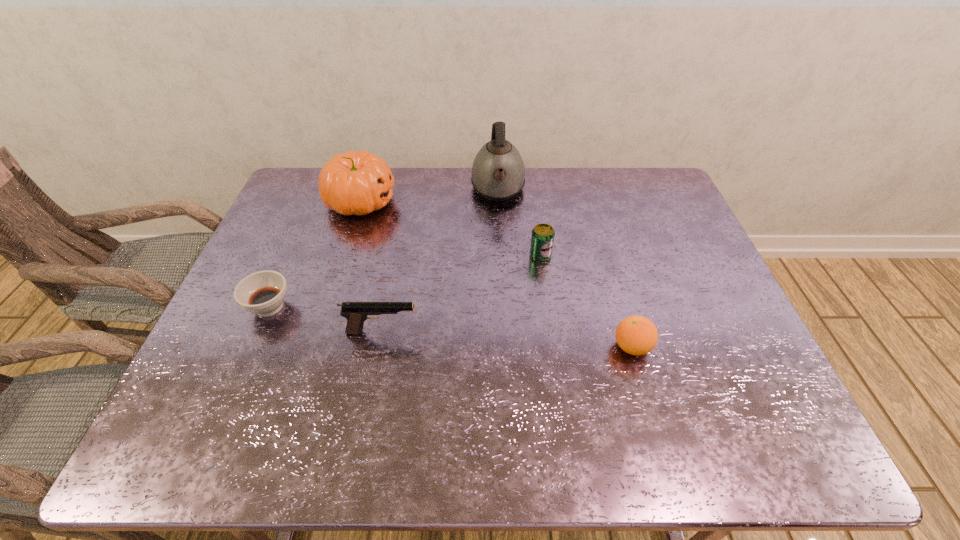
In the image, there is a desktop. Identify the location of vacant space at the left edge. The image size is (960, 540). (220, 395).

In the image, there is a desktop. Where is `vacant area at the right edge`? Image resolution: width=960 pixels, height=540 pixels. vacant area at the right edge is located at coordinates (703, 377).

This screenshot has width=960, height=540. In the image, there is a desktop. Find the location of `free space at the near right corner`. free space at the near right corner is located at coordinates (787, 446).

I want to click on free space between the beer can and the soup bowl, so click(405, 281).

Where is `unoccupied area between the kettle and the pumpkin`? The width and height of the screenshot is (960, 540). unoccupied area between the kettle and the pumpkin is located at coordinates (429, 196).

Where is `free spot between the soup bowl and the third farthest object`? This screenshot has width=960, height=540. free spot between the soup bowl and the third farthest object is located at coordinates (405, 281).

Image resolution: width=960 pixels, height=540 pixels. I want to click on vacant area that lies between the soup bowl and the kettle, so click(384, 248).

The width and height of the screenshot is (960, 540). I want to click on vacant point located between the rightmost object and the tallest object, so click(x=564, y=268).

This screenshot has height=540, width=960. I want to click on vacant area between the fourth farthest object and the third farthest object, so click(x=405, y=281).

The height and width of the screenshot is (540, 960). In order to click on vacant space that is in between the rightmost object and the pistol in this screenshot , I will do `click(507, 339)`.